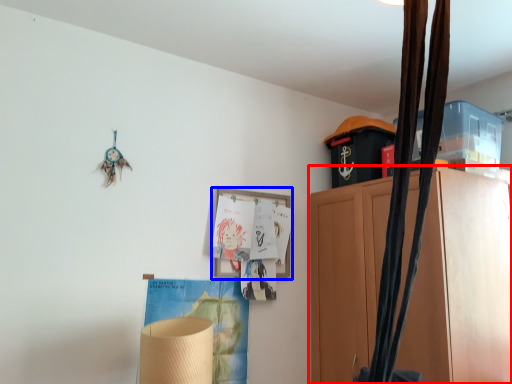
Question: Which object appears closest to the camera in this image, cabinetry (highlighted by a red box) or picture frame (highlighted by a blue box)?

Choices:
 (A) cabinetry
 (B) picture frame

Answer: (A)